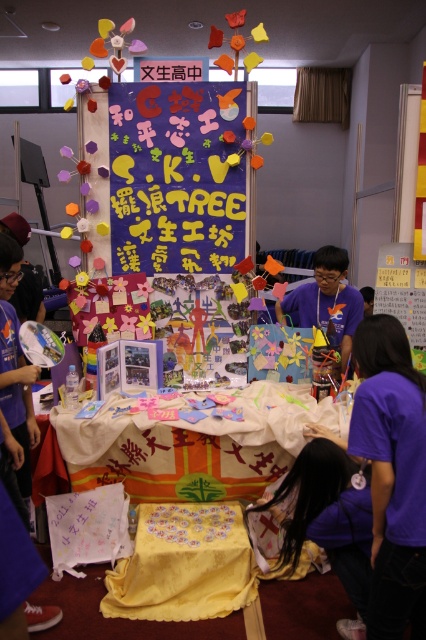
Who is more forward, (x=118, y=236) or (x=238, y=604)?

Point (x=238, y=604) is more forward.

Identify the location of purple paperboard at center. This screenshot has width=426, height=640. (176, 177).

Who is positioned more to the left, yellow fabric-covered table at center or purple fabric at center?

Positioned to the left is yellow fabric-covered table at center.

Between point (141, 552) and point (351, 317), which one is positioned in front?

Point (141, 552) is in front.

Who is more forward, (x=201, y=525) or (x=340, y=323)?

Point (x=201, y=525) is more forward.

Where is `yellow fabric-covered table at center`? This screenshot has width=426, height=640. yellow fabric-covered table at center is located at coordinates click(x=187, y=566).

Is purple fabric at lower right wider than purple fabric at center?

In fact, purple fabric at lower right might be narrower than purple fabric at center.

Can you confirm if purple fabric at lower right is positioned above purple fabric at center?

Incorrect, purple fabric at lower right is not positioned above purple fabric at center.

Measure the distance between point (x=282, y=557) and camera.

Point (x=282, y=557) and camera are 2.29 meters apart.

Locate an element on the screen. This screenshot has width=426, height=640. purple fabric at lower right is located at coordinates (328, 520).